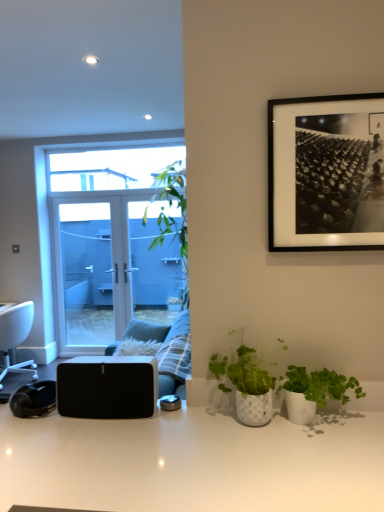
Question: From a real-world perspective, is black matte speaker at lower left above or below green matte plant at center, the first houseplant from the left?

Choices:
 (A) above
 (B) below

Answer: (B)

Question: Based on their positions, is black matte speaker at lower left located to the left or right of green matte plant at center, the first houseplant from the left?

Choices:
 (A) right
 (B) left

Answer: (B)

Question: Estimate the real-world distances between objects in this image. Which object is farther from the white glossy desk at center?

Choices:
 (A) white plastic chair at left
 (B) blue glass door at center
 (C) plush fabric couch at center
 (D) green matte plant at lower right, the second houseplant viewed from the left
 (E) black matte speaker at lower left

Answer: (A)

Question: Which of these objects is positioned closest to the black matte picture frame at upper right?

Choices:
 (A) white plastic chair at left
 (B) green matte plant at center, the first houseplant from the left
 (C) blue glass door at center
 (D) green matte plant at lower right, the first houseplant positioned from the right
 (E) black matte speaker at lower left

Answer: (B)